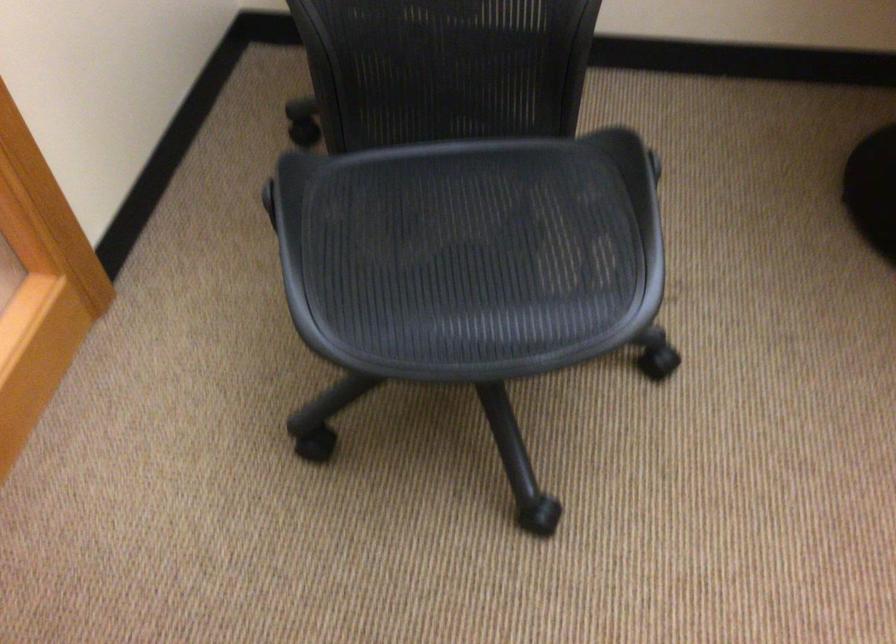
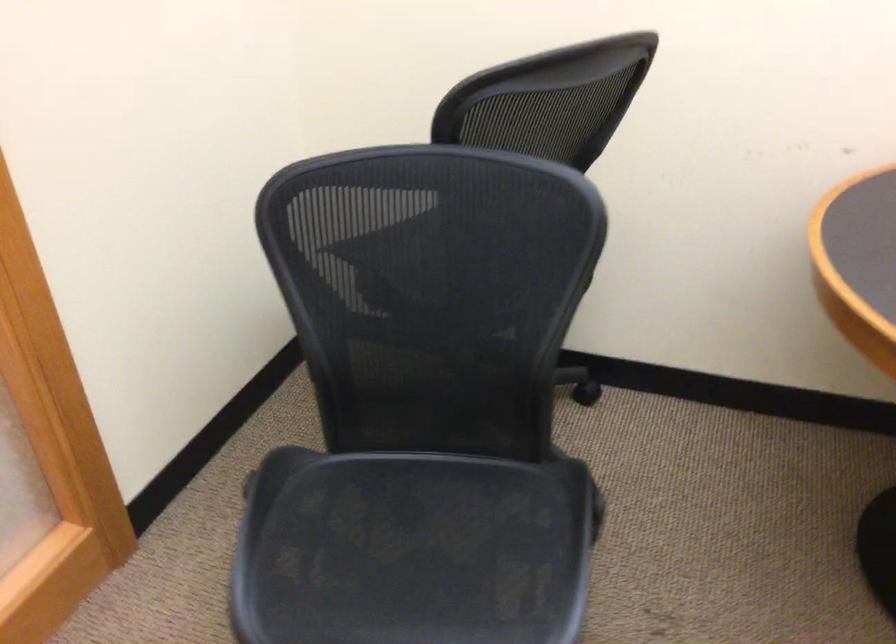
What movement of the cameraman would produce the second image?

The cameraman walked toward right, backward.